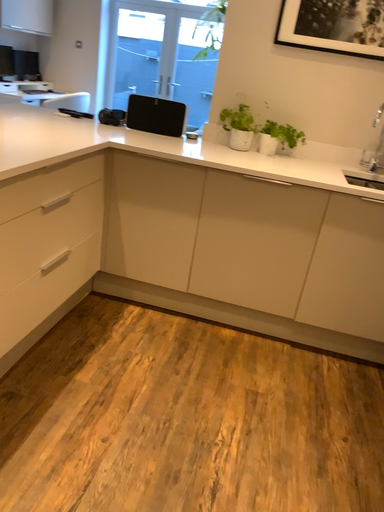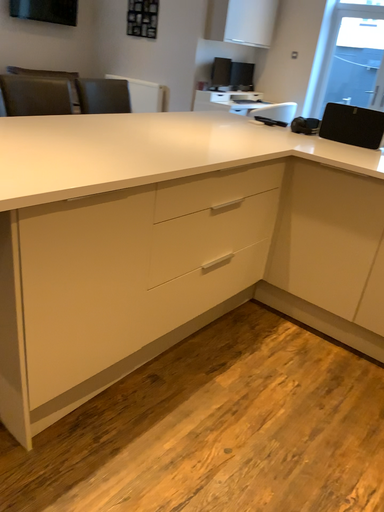
Question: How did the camera likely rotate when shooting the video?

Choices:
 (A) rotated right
 (B) rotated left

Answer: (B)